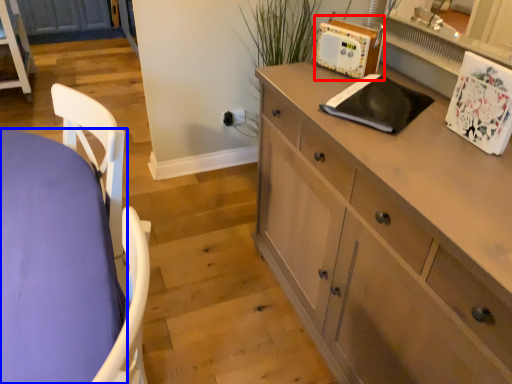
Question: Which point is further to the camera, appliance (highlighted by a red box) or desk (highlighted by a blue box)?

Choices:
 (A) appliance
 (B) desk

Answer: (A)